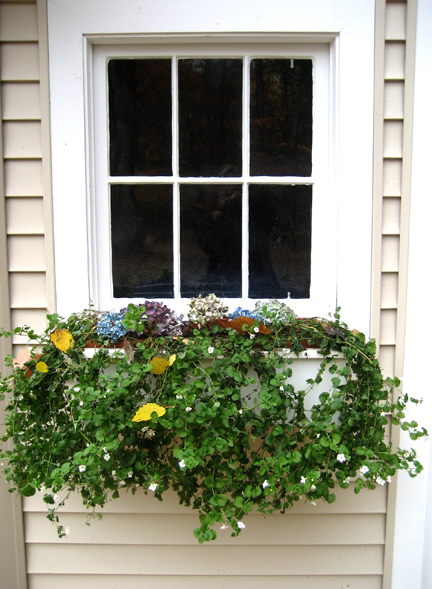
Where is `gray wall`? Image resolution: width=432 pixels, height=589 pixels. gray wall is located at coordinates (22, 210).